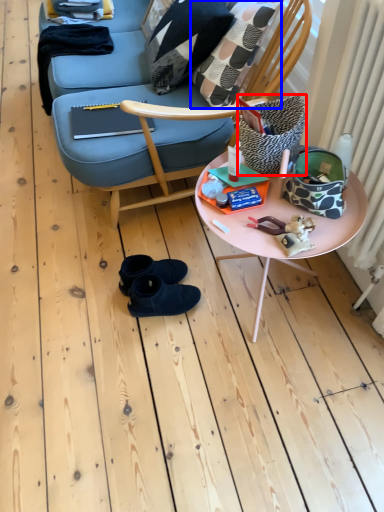
Question: Which of the following is the farthest to the observer, pillow (highlighted by a red box) or throw pillow (highlighted by a blue box)?

Choices:
 (A) pillow
 (B) throw pillow

Answer: (B)